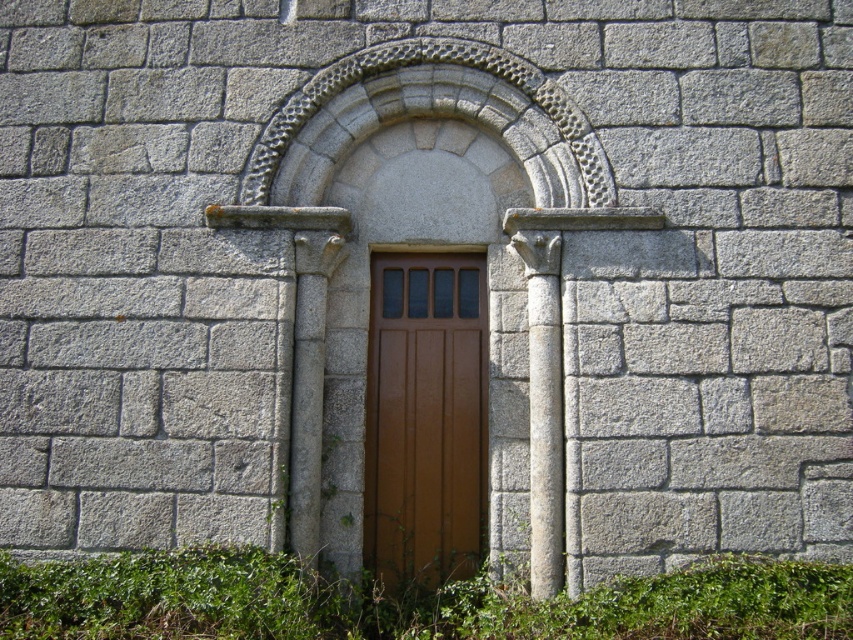
You are standing in front of the stone wall with the wooden door. You notice a green leafy weed at lower center and a gray stone column at right. Which object is positioned closer to the left side of the door?

The green leafy weed at lower center is positioned closer to the left side of the door since it is to the left of the gray stone column at right.

You are a gardener who needs to remove weeds from the stone wall area. You see the green leafy weed at lower center and the brown wooden door at center. Which object requires more effort to remove?

The green leafy weed at lower center requires more effort to remove because it is larger in size than the brown wooden door at center.